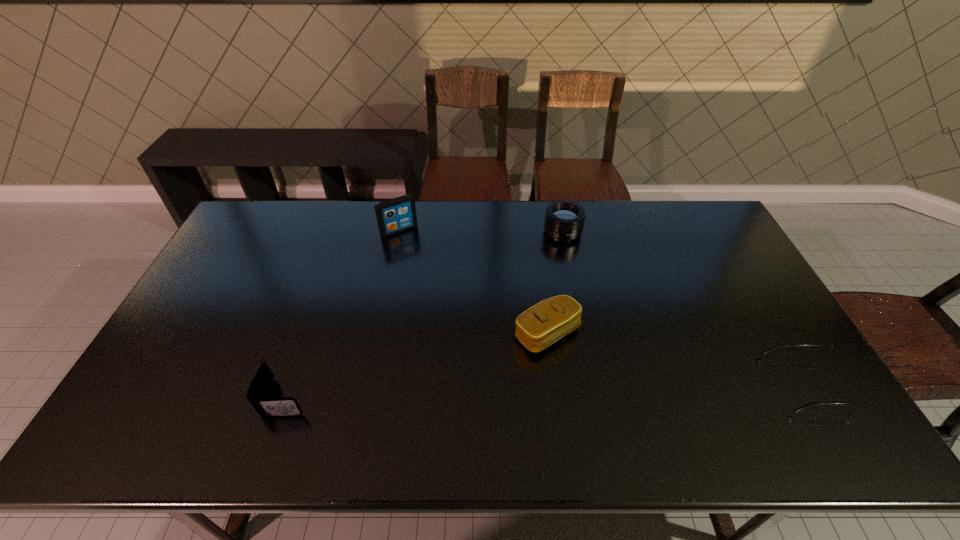
Where is `wallet`? wallet is located at coordinates (258, 390).

The width and height of the screenshot is (960, 540). Identify the location of the shortest object. (856, 393).

You are a GUI agent. You are given a task and a screenshot of the screen. Output one action in this format:
    pyautogui.click(x=<x>, y=<y>)
    Task: Click on the rightmost object
    The height and width of the screenshot is (540, 960).
    Given the screenshot: What is the action you would take?
    pyautogui.click(x=856, y=393)

This screenshot has height=540, width=960. What are the coordinates of `clutch bag` in the screenshot? It's located at (540, 326).

Find the location of a particular element. Image resolution: width=960 pixels, height=540 pixels. the fourth object from right to left is located at coordinates (398, 214).

Where is `iPod`? This screenshot has width=960, height=540. iPod is located at coordinates (398, 214).

At what (x,y) coordinates should I click in order to perform the action: click on telephoto lens. Please return your answer as a coordinate pair (x, y). The width and height of the screenshot is (960, 540). Looking at the image, I should click on (564, 219).

Identify the location of free space located 0.220m on the outer surface of the leftmost object. point(397,397).

You are a GUI agent. You are given a task and a screenshot of the screen. Output one action in this format:
    pyautogui.click(x=<x>, y=<y>)
    Task: Click on the free space located 0.060m on the zipper side of the clutch bag
    This screenshot has width=960, height=540.
    Given the screenshot: What is the action you would take?
    pyautogui.click(x=583, y=370)

What are the coordinates of `free spot located on the zipper side of the clutch bag` in the screenshot? It's located at (618, 409).